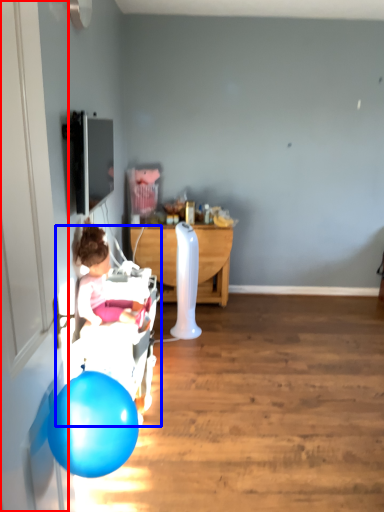
Question: Among these objects, which one is nearest to the camera, door (highlighted by a red box) or baby carriage (highlighted by a blue box)?

Choices:
 (A) door
 (B) baby carriage

Answer: (A)